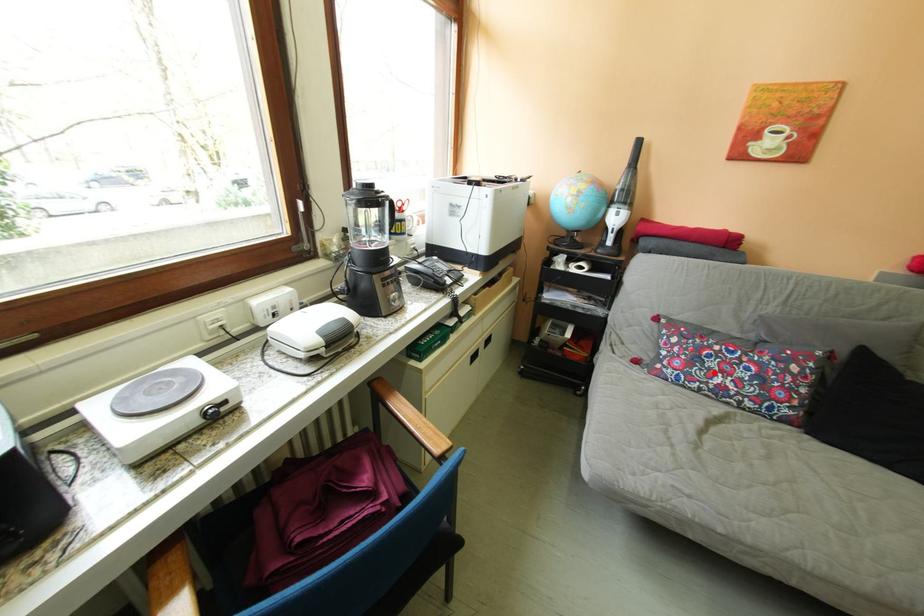
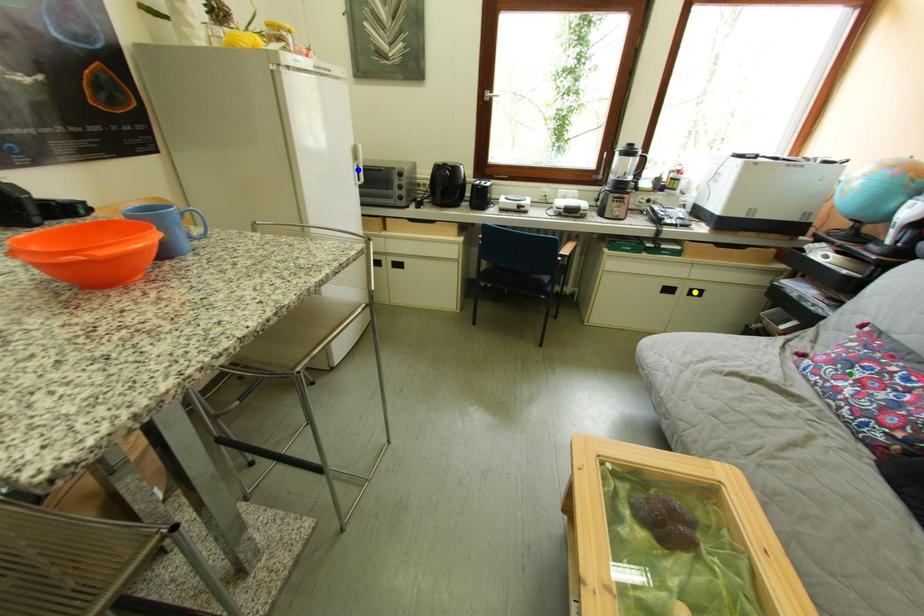
Question: I am providing you with two images of the same scene from different viewpoints. A red point is marked on the first image. You are given multiple points on the second image. In image 2, which mark is for the same physical point as the one in image 1?

Choices:
 (A) blue point
 (B) green point
 (C) yellow point

Answer: (B)